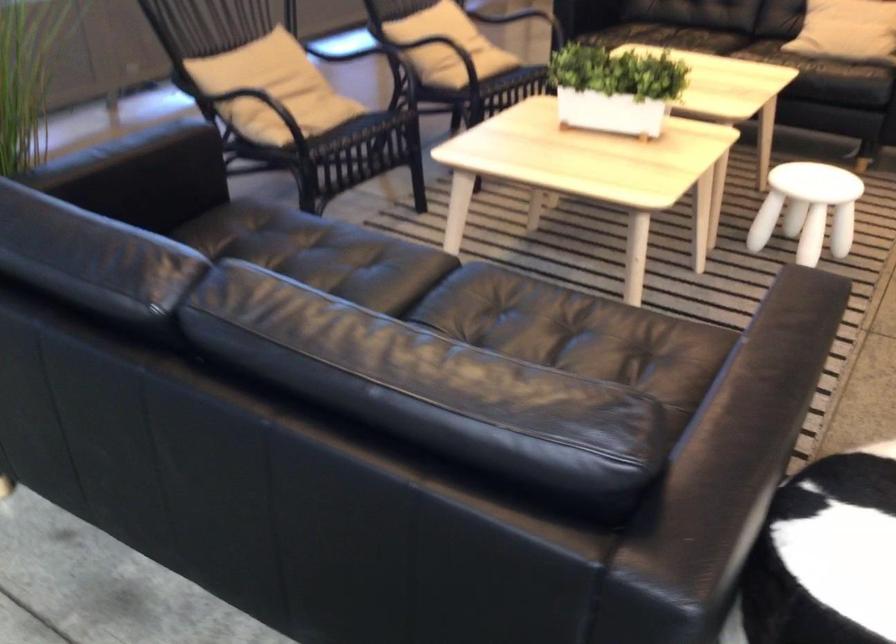
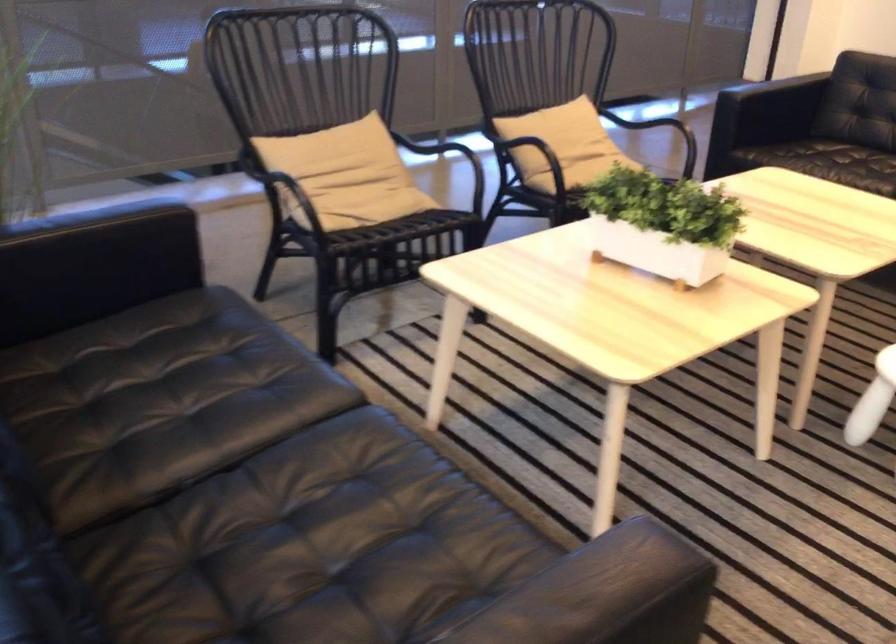
Question: The camera is either moving clockwise (left) or counter-clockwise (right) around the object. The first image is from the beginning of the video and the second image is from the end. Is the camera moving left or right when shooting the video?

Choices:
 (A) Left
 (B) Right

Answer: (B)